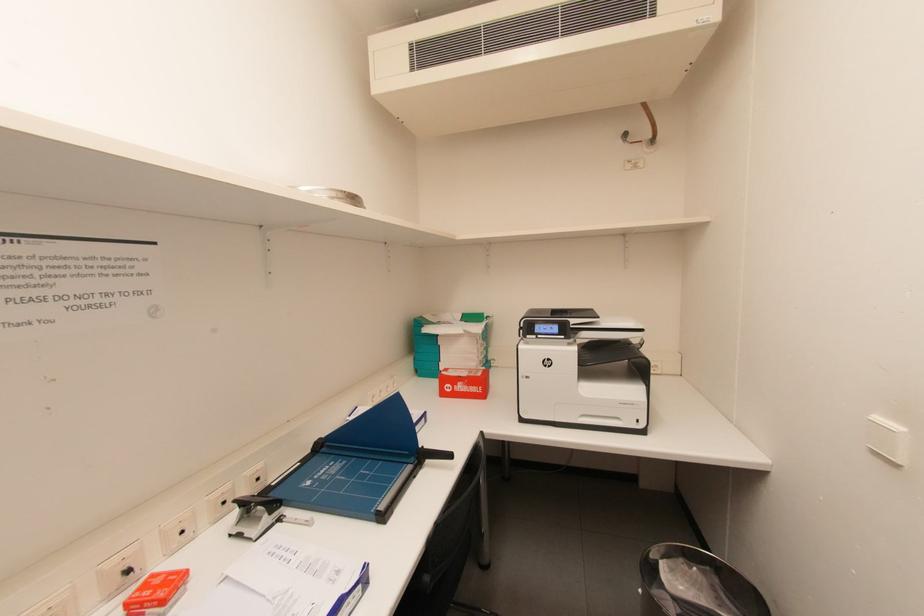
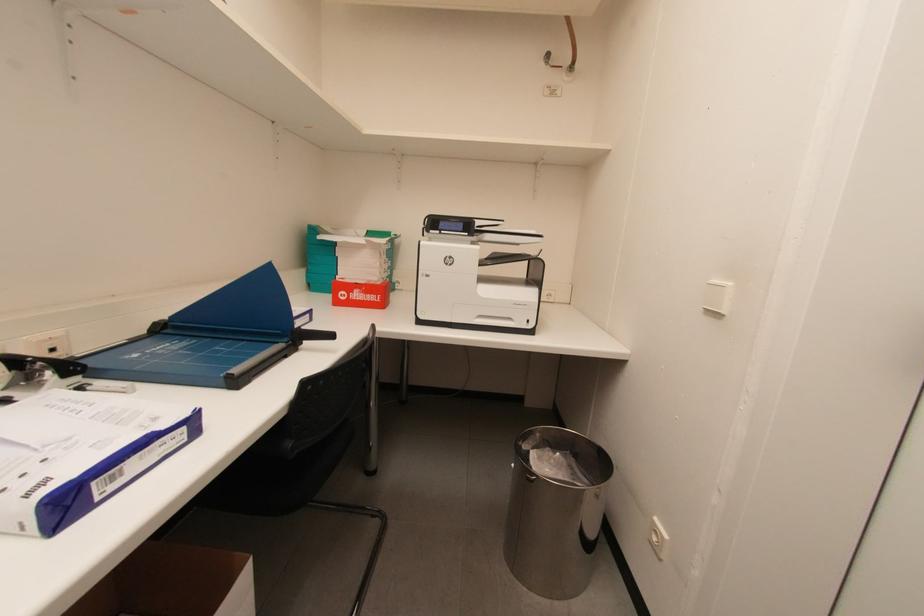
Question: The camera is either moving clockwise (left) or counter-clockwise (right) around the object. The first image is from the beginning of the video and the second image is from the end. Is the camera moving left or right when shooting the video?

Choices:
 (A) Left
 (B) Right

Answer: (A)